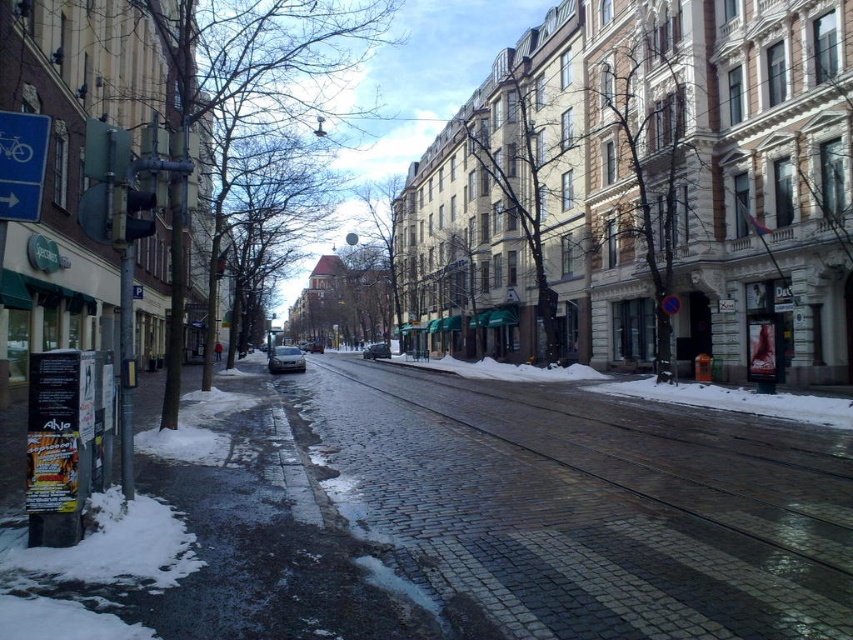
Question: Which of the following is the closest to the observer?

Choices:
 (A) satin silver car at center
 (B) dark gray cobblestone pavement at center
 (C) black glossy car at center

Answer: (B)

Question: Can you confirm if dark gray cobblestone pavement at center is bigger than black glossy car at center?

Choices:
 (A) no
 (B) yes

Answer: (A)

Question: From the image, what is the correct spatial relationship of dark gray cobblestone pavement at center in relation to satin silver car at center?

Choices:
 (A) below
 (B) above

Answer: (A)

Question: Which point appears closest to the camera in this image?

Choices:
 (A) (286, 353)
 (B) (376, 342)

Answer: (A)

Question: Can you confirm if dark gray cobblestone pavement at center is positioned to the right of satin silver car at center?

Choices:
 (A) no
 (B) yes

Answer: (B)

Question: Which of these objects is positioned closest to the dark gray cobblestone pavement at center?

Choices:
 (A) black glossy car at center
 (B) satin silver car at center

Answer: (B)